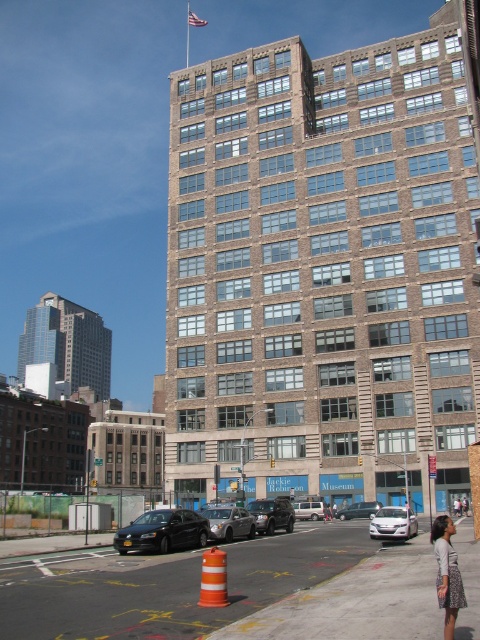
Question: In this image, where is floral-patterned skirt at lower right located relative to silver metallic van at center?

Choices:
 (A) below
 (B) above

Answer: (B)

Question: Estimate the real-world distances between objects in this image. Which object is farther from the metallic silver sedan at center?

Choices:
 (A) shiny black suv at center
 (B) brown brick building at center
 (C) floral-patterned skirt at lower right
 (D) glassy blue skyscraper at left

Answer: (D)

Question: Can you confirm if shiny black sedan at lower left is bigger than floral-patterned skirt at lower right?

Choices:
 (A) yes
 (B) no

Answer: (B)

Question: Which point is farther to the camera?

Choices:
 (A) glassy blue skyscraper at left
 (B) red fabric flag at upper center
 (C) metallic silver sedan at center
 (D) silver metallic van at center

Answer: (B)

Question: Where is brown brick building at center located in relation to shiny black suv at center in the image?

Choices:
 (A) below
 (B) above

Answer: (B)

Question: Among these points, which one is farthest from the camera?

Choices:
 (A) (204, 22)
 (B) (411, 513)

Answer: (A)